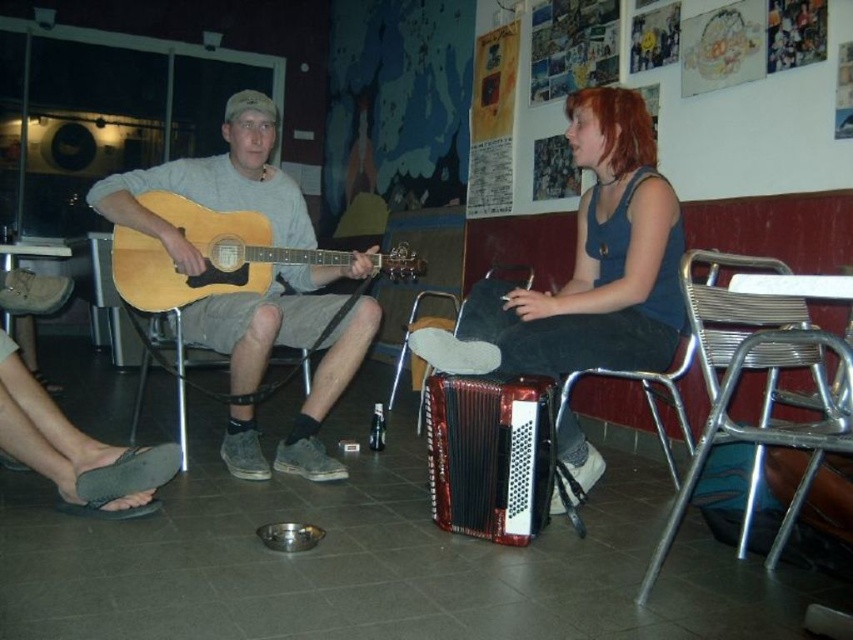
Looking at this image, measure the distance between matte wood guitar at left and metallic silver chair at center.

matte wood guitar at left is 1.05 meters away from metallic silver chair at center.

In the scene shown: Can you confirm if matte wood guitar at left is taller than metallic silver chair at center?

Yes, matte wood guitar at left is taller than metallic silver chair at center.

What are the coordinates of `matte wood guitar at left` in the screenshot? It's located at (215, 184).

The width and height of the screenshot is (853, 640). I want to click on matte wood guitar at left, so click(215, 184).

Does metallic silver chair at right appear on the left side of metallic silver chair at center?

No, metallic silver chair at right is not to the left of metallic silver chair at center.

Can you confirm if metallic silver chair at right is smaller than metallic silver chair at center?

No.

Who is more forward, (x=747, y=282) or (x=398, y=355)?

Positioned in front is point (x=747, y=282).

Locate an element on the screen. The width and height of the screenshot is (853, 640). metallic silver chair at right is located at coordinates (766, 378).

Between point (225, 449) and point (250, 396), which one is positioned in front?

Point (250, 396)

Between matte wood guitar at left and metallic silver chair at left, which one has more height?

matte wood guitar at left

Describe the element at coordinates (215, 184) in the screenshot. I see `matte wood guitar at left` at that location.

The height and width of the screenshot is (640, 853). I want to click on matte wood guitar at left, so point(215,184).